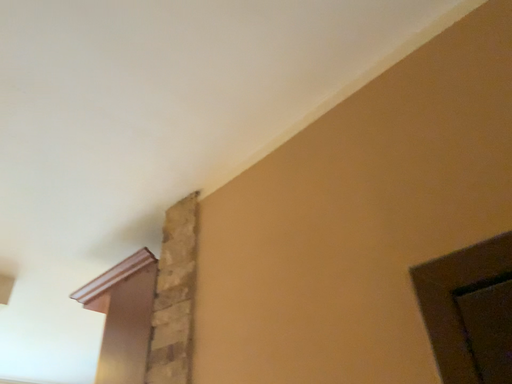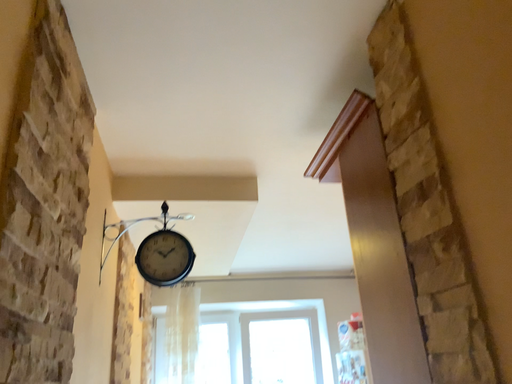
Question: Which way did the camera rotate in the video?

Choices:
 (A) rotated right
 (B) rotated left

Answer: (B)